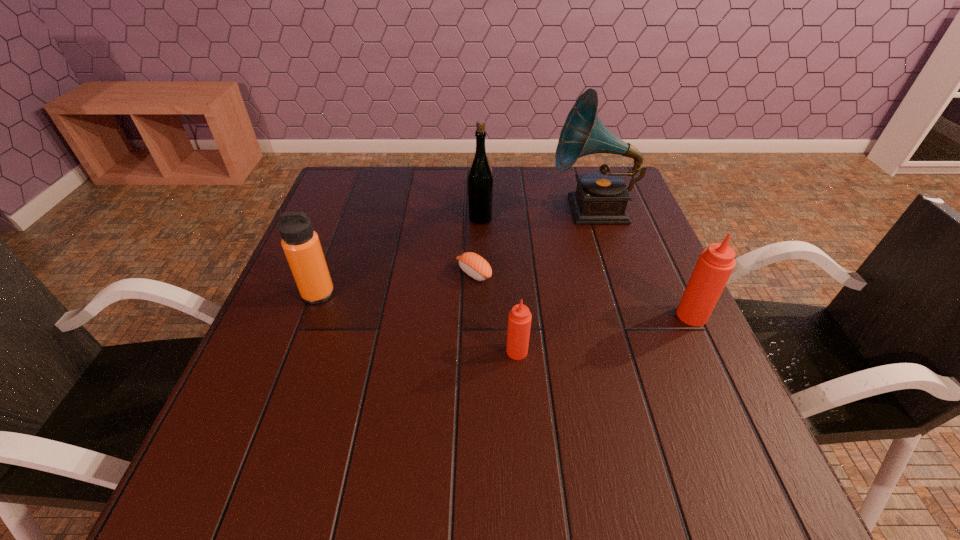
The height and width of the screenshot is (540, 960). Find the location of `the fifth tallest object`. the fifth tallest object is located at coordinates (519, 321).

In order to click on the shorter Tabasco sauce in this screenshot , I will do `click(519, 321)`.

I want to click on the farther Tabasco sauce, so click(x=715, y=265).

The width and height of the screenshot is (960, 540). Find the location of `the taller Tabasco sauce`. the taller Tabasco sauce is located at coordinates (715, 265).

Locate an element on the screen. The height and width of the screenshot is (540, 960). the fifth shortest object is located at coordinates (480, 179).

Where is `phonograph_record`? Image resolution: width=960 pixels, height=540 pixels. phonograph_record is located at coordinates (601, 197).

What are the coordinates of `the leftmost object` in the screenshot? It's located at (301, 244).

Locate an element on the screen. This screenshot has height=540, width=960. sushi is located at coordinates (474, 265).

Image resolution: width=960 pixels, height=540 pixels. Find the location of `blank space located on the front of the left Tabasco sauce`. blank space located on the front of the left Tabasco sauce is located at coordinates 521,410.

Find the location of a particular element. This screenshot has width=960, height=540. blank space located on the left of the farther Tabasco sauce is located at coordinates (536, 315).